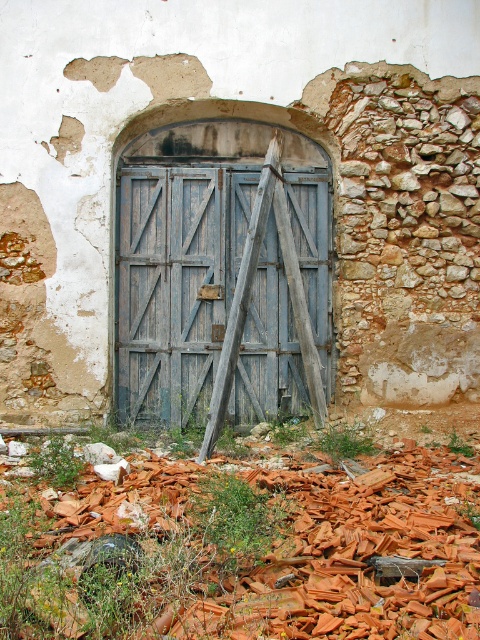
Is orange clay tiles at center below blue wooden door at center?

Correct, orange clay tiles at center is located below blue wooden door at center.

Identify the location of orange clay tiles at center. The width and height of the screenshot is (480, 640). (305, 541).

Is point (162, 625) positioned in front of point (160, 129)?

Yes, it is in front of point (160, 129).

You are a GUI agent. You are given a task and a screenshot of the screen. Output one action in this format:
    pyautogui.click(x=<x>, y=<y>)
    Task: Click on the orange clay tiles at center
    
    Given the screenshot: What is the action you would take?
    pyautogui.click(x=305, y=541)